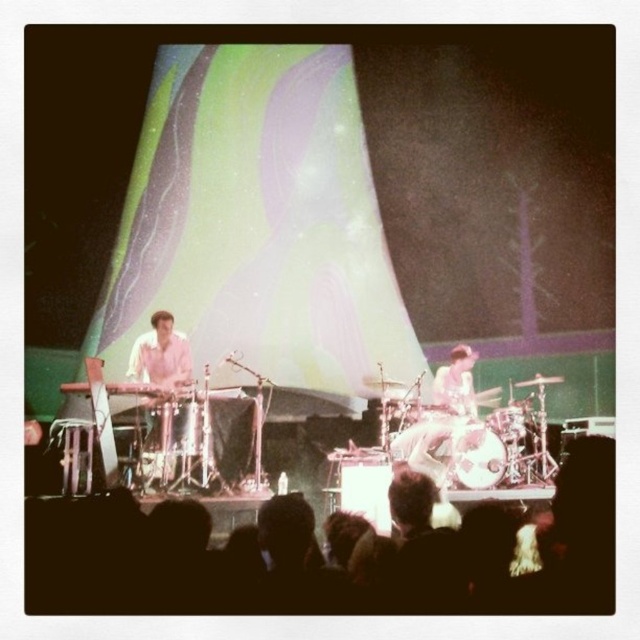
Between white wood drum at center and brushed metal drum at center, which one is positioned lower?

Positioned lower is white wood drum at center.

Locate an element on the screen. Image resolution: width=640 pixels, height=640 pixels. white wood drum at center is located at coordinates (476, 456).

Where is `white wood drum at center`? white wood drum at center is located at coordinates (476, 456).

Does white wood drum at center come in front of smooth white drum at center?

Yes, it is in front of smooth white drum at center.

Can you confirm if white wood drum at center is bigger than smooth white drum at center?

Incorrect, white wood drum at center is not larger than smooth white drum at center.

Describe the element at coordinates (476, 456) in the screenshot. This screenshot has height=640, width=640. I see `white wood drum at center` at that location.

Locate an element on the screen. The width and height of the screenshot is (640, 640). white wood drum at center is located at coordinates (476, 456).

Is brushed metal drum at center positioned in front of smooth white drum at center?

Yes, brushed metal drum at center is closer to the viewer.

Does brushed metal drum at center appear on the left side of smooth white drum at center?

Yes, brushed metal drum at center is to the left of smooth white drum at center.

Between point (186, 417) and point (497, 417), which one is positioned in front?

Point (186, 417) is in front.

Where is `brushed metal drum at center`? The width and height of the screenshot is (640, 640). brushed metal drum at center is located at coordinates (186, 428).